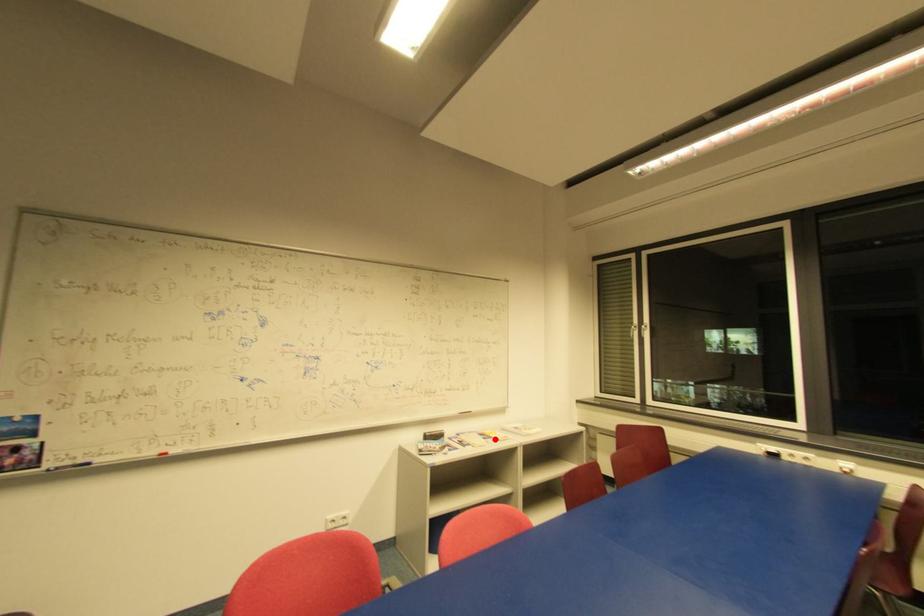
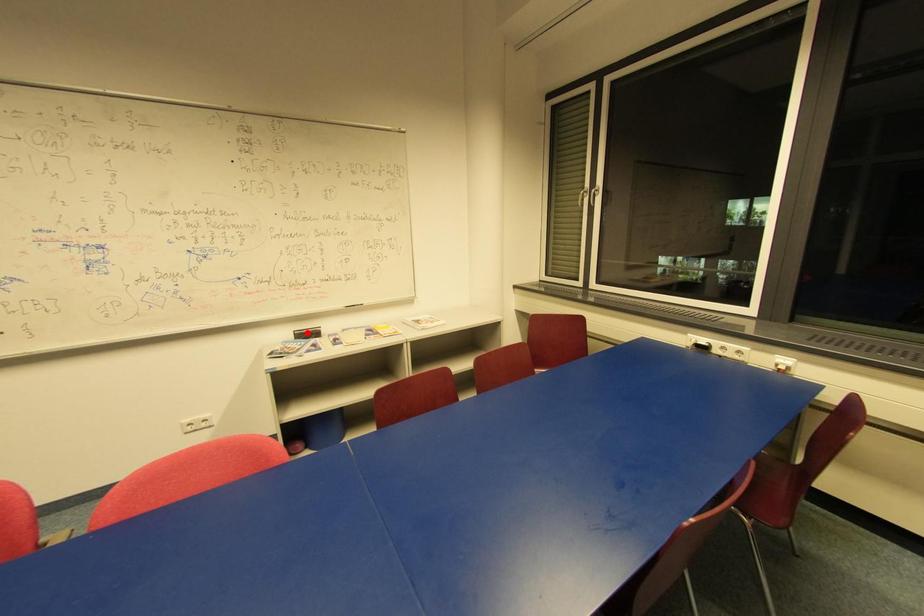
I am providing you with two images of the same scene from different viewpoints. A red point is marked on the first image and another point is marked on the second image. Is the red point in image1 aligned with the point shown in image2?

No